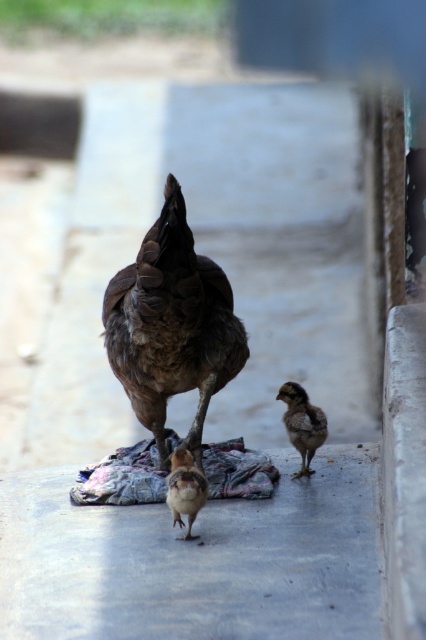
Who is more distant from viewer, (403, 595) or (187, 465)?

Point (187, 465)

Which of these two, smooth concrete curb at right or brown feathered bird at center, stands taller?

smooth concrete curb at right is taller.

Between point (408, 412) and point (170, 502), which one is positioned behind?

Positioned behind is point (170, 502).

Image resolution: width=426 pixels, height=640 pixels. I want to click on smooth concrete curb at right, so click(405, 468).

Consider the image. Can you confirm if gray concrete at center is wider than smooth concrete curb at right?

Correct, the width of gray concrete at center exceeds that of smooth concrete curb at right.

Can you confirm if gray concrete at center is bigger than smooth concrete curb at right?

Yes, gray concrete at center is bigger than smooth concrete curb at right.

Between point (374, 477) and point (406, 413), which one is positioned in front?

Point (406, 413) is in front.

Locate an element on the screen. This screenshot has width=426, height=640. gray concrete at center is located at coordinates 196,561.

Is smooth concrete curb at right further to camera compared to brown fluffy chick at center?

No, smooth concrete curb at right is closer to the viewer.

Is point (420, 413) more distant than point (305, 452)?

That is False.

Find the location of a particular element. Image resolution: width=426 pixels, height=640 pixels. smooth concrete curb at right is located at coordinates (405, 468).